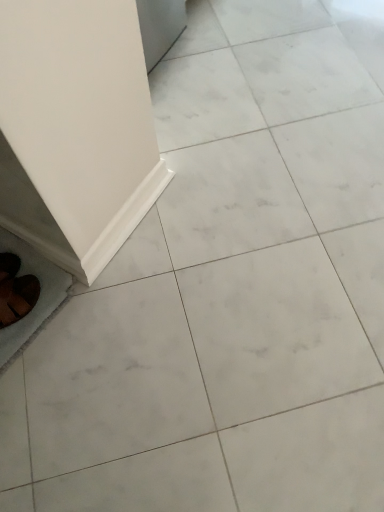
I want to click on free space in front of white glossy ceramic tile at lower left, the first ceramic tile viewed from the left, so click(x=45, y=408).